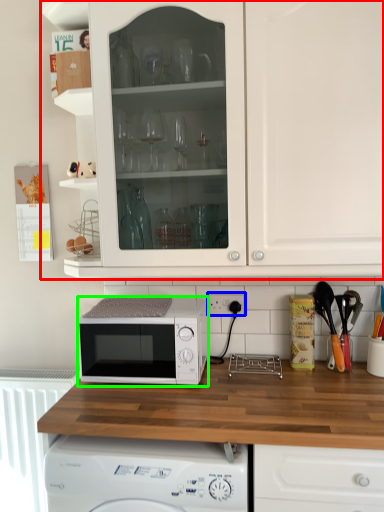
Question: Which object is positioned farthest from cabinetry (highlighted by a red box)? Select from electric outlet (highlighted by a blue box) and microwave oven (highlighted by a green box).

Choices:
 (A) electric outlet
 (B) microwave oven

Answer: (A)